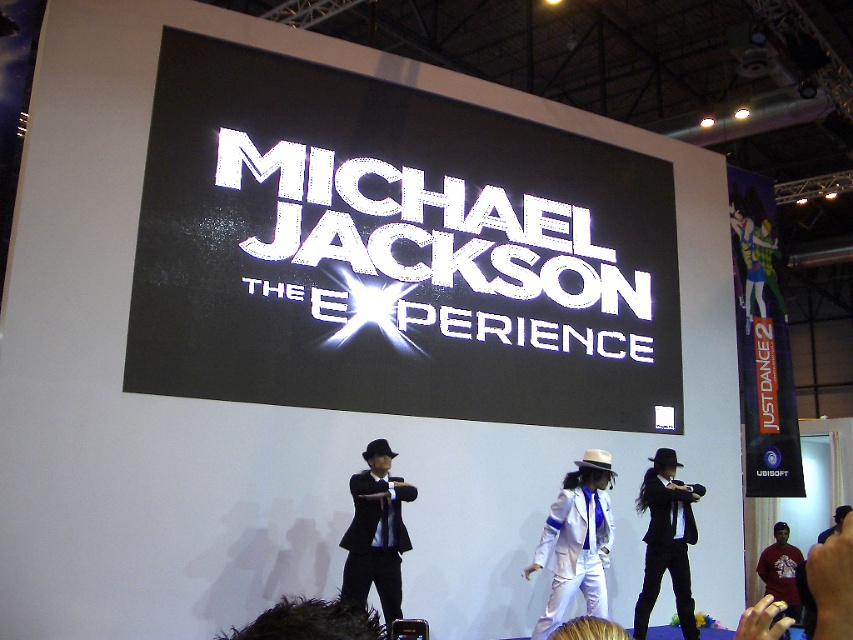
Question: Can you confirm if black matte suit at center is positioned above shiny black suit at center?

Choices:
 (A) no
 (B) yes

Answer: (B)

Question: Is white satin hat at center below black matte suit at center?

Choices:
 (A) no
 (B) yes

Answer: (B)

Question: Among these points, which one is farthest from the camera?

Choices:
 (A) (666, 502)
 (B) (369, 492)
 (C) (581, 493)

Answer: (A)

Question: Among these objects, which one is nearest to the camera?

Choices:
 (A) black matte suit at center
 (B) red cotton shirt at lower right
 (C) white satin hat at center

Answer: (A)

Question: Is white satin hat at center to the left of shiny black suit at center from the viewer's perspective?

Choices:
 (A) yes
 (B) no

Answer: (A)

Question: Among these points, which one is farthest from the camera?

Choices:
 (A) (590, 582)
 (B) (785, 547)

Answer: (B)